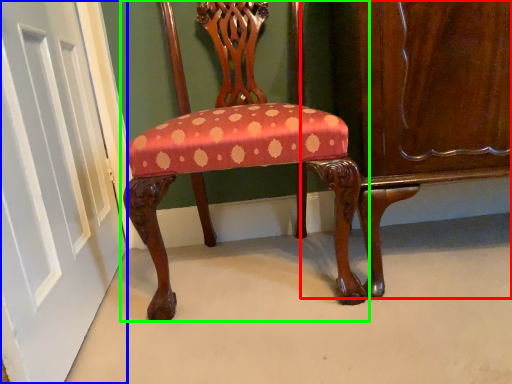
Question: Considering the real-world distances, which object is closest to dresser (highlighted by a red box)? door (highlighted by a blue box) or chair (highlighted by a green box).

Choices:
 (A) door
 (B) chair

Answer: (B)